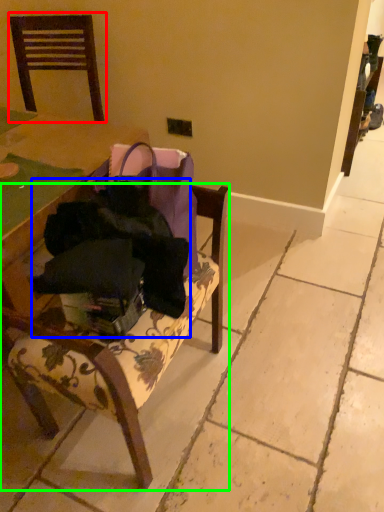
Question: Considering the real-world distances, which object is closest to chair (highlighted by a red box)? clothing (highlighted by a blue box) or chair (highlighted by a green box).

Choices:
 (A) clothing
 (B) chair

Answer: (B)